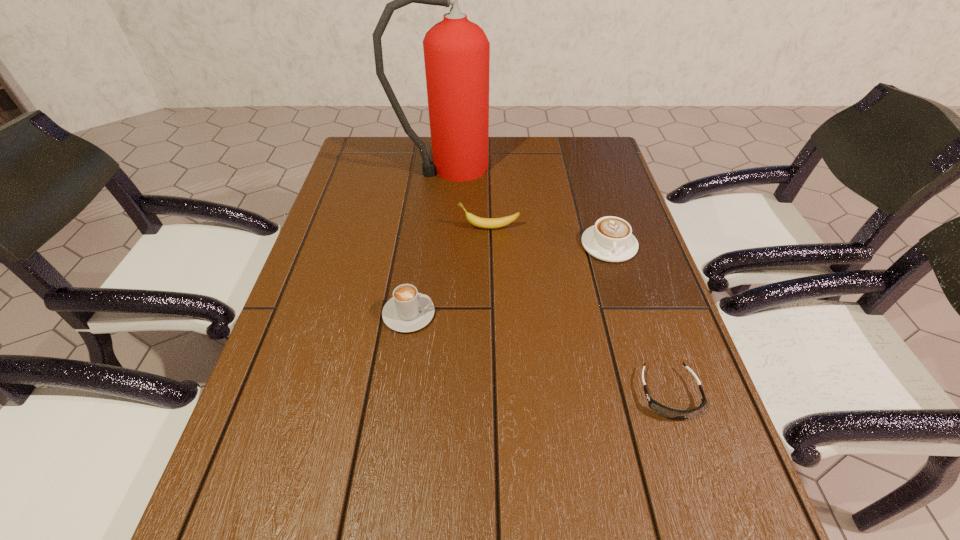
You are a GUI agent. You are given a task and a screenshot of the screen. Output one action in this format:
    pyautogui.click(x=<x>, y=<y>)
    Task: Click on the vacant space located at the stem of the banana
    This screenshot has width=960, height=540.
    Given the screenshot: What is the action you would take?
    pos(380,227)

Identify the location of vacant region located 0.080m at the stem of the banana. This screenshot has height=540, width=960. (429, 227).

Where is `vacant space located 0.130m at the stem of the banana`? This screenshot has width=960, height=540. vacant space located 0.130m at the stem of the banana is located at coordinates (410, 227).

Where is `vacant area located 0.140m to the right of the second nearest object`? vacant area located 0.140m to the right of the second nearest object is located at coordinates (497, 314).

In order to click on vacant space located 0.400m with the handle on the right side of the farther cappuccino in this screenshot , I will do `click(660, 415)`.

Identify the location of vacant area located on the front and sides of the shortest object. (712, 526).

Where is `object that is at the far edge`? Image resolution: width=960 pixels, height=540 pixels. object that is at the far edge is located at coordinates (456, 51).

You are a GUI agent. You are given a task and a screenshot of the screen. Output one action in this format:
    pyautogui.click(x=<x>, y=<y>)
    Task: Click on the object that is at the left edge
    
    Given the screenshot: What is the action you would take?
    coord(456,51)

Identify the location of cappuccino that is at the right edge. The width and height of the screenshot is (960, 540). (610, 239).

I want to click on goggles that is at the right edge, so click(x=669, y=413).